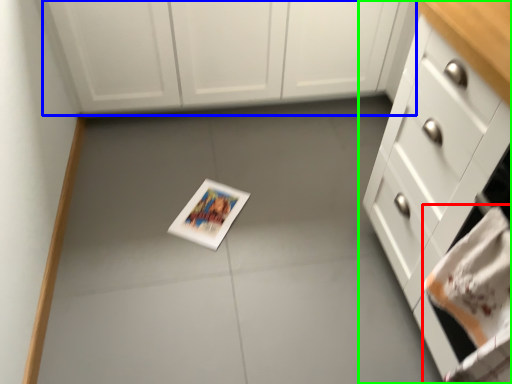
Question: Considering the real-world distances, which object is farthest from hand towel (highlighted by a red box)? cabinetry (highlighted by a blue box) or cabinetry (highlighted by a green box)?

Choices:
 (A) cabinetry
 (B) cabinetry

Answer: (A)